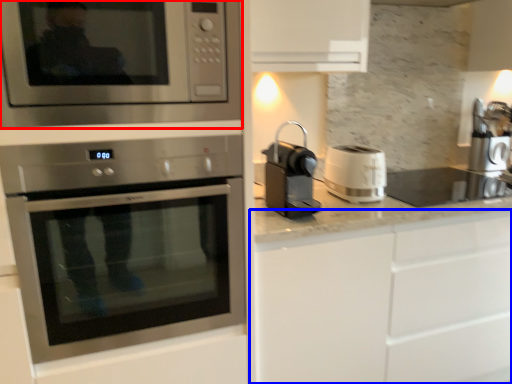
Question: Among these objects, which one is farthest to the camera, microwave oven (highlighted by a red box) or cabinetry (highlighted by a blue box)?

Choices:
 (A) microwave oven
 (B) cabinetry

Answer: (B)